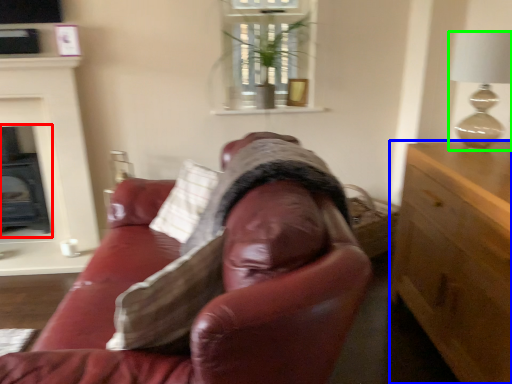
Question: Considering the real-world distances, which object is farthest from fireplace (highlighted by a red box)? cabinetry (highlighted by a blue box) or lamp (highlighted by a green box)?

Choices:
 (A) cabinetry
 (B) lamp

Answer: (B)